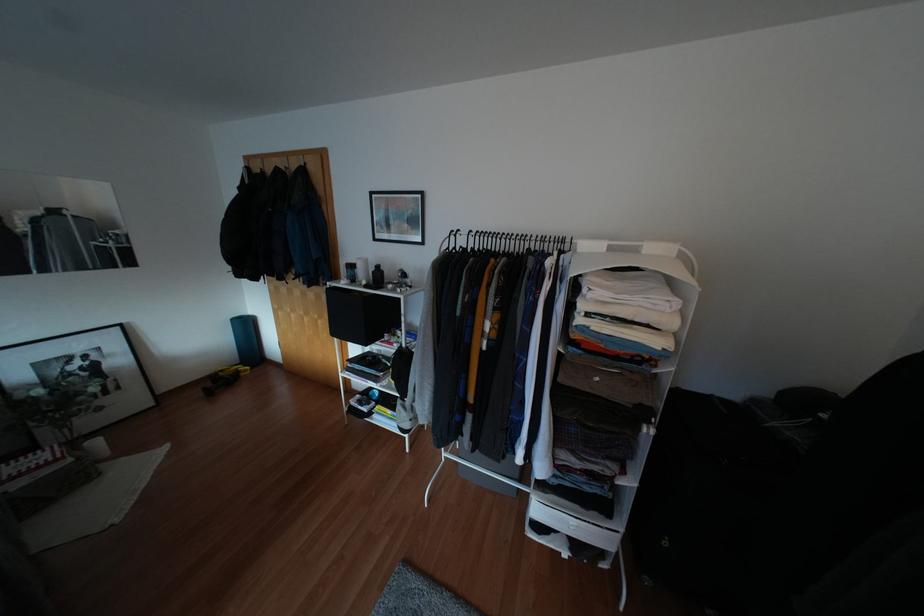
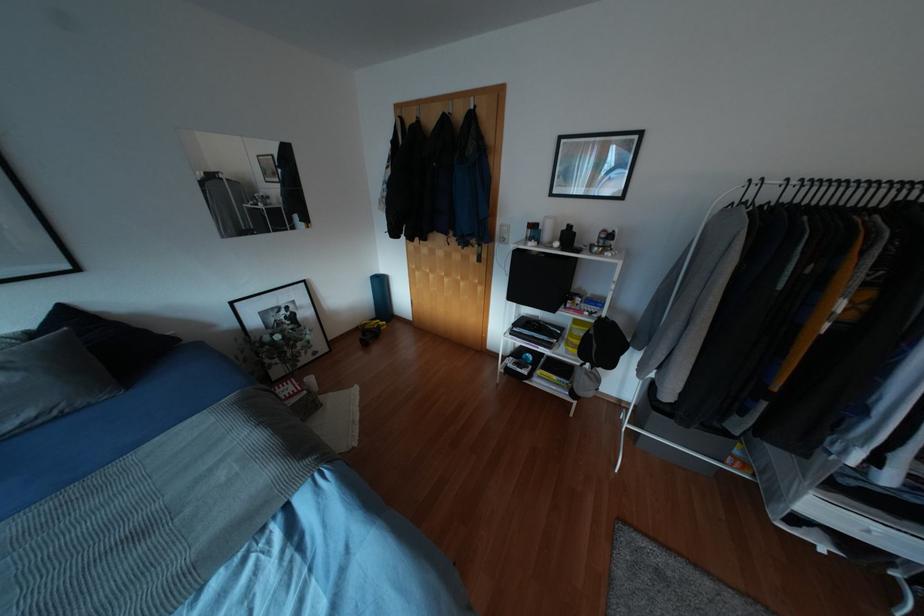
Question: The first image is from the beginning of the video and the second image is from the end. How did the camera likely rotate when shooting the video?

Choices:
 (A) Left
 (B) Right
 (C) Up
 (D) Down

Answer: (A)